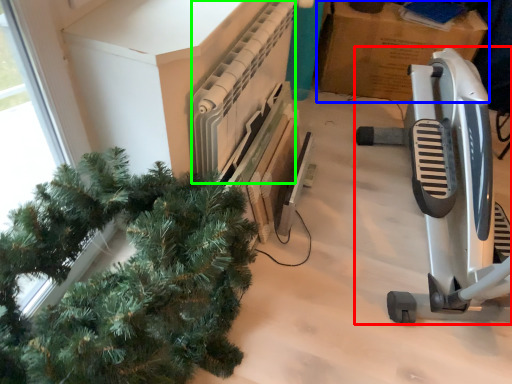
Question: Which object is the farthest from job (highlighted by a red box)? Choose among these: cardboard box (highlighted by a blue box) or radiator (highlighted by a green box).

Choices:
 (A) cardboard box
 (B) radiator

Answer: (A)